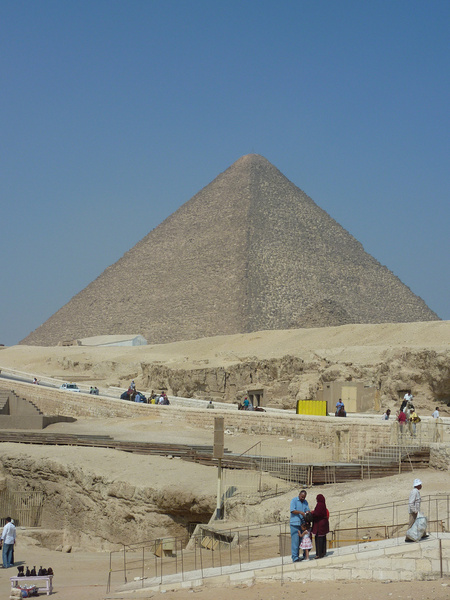
Locate an element on the screen. The image size is (450, 600). table is located at coordinates [44, 578].